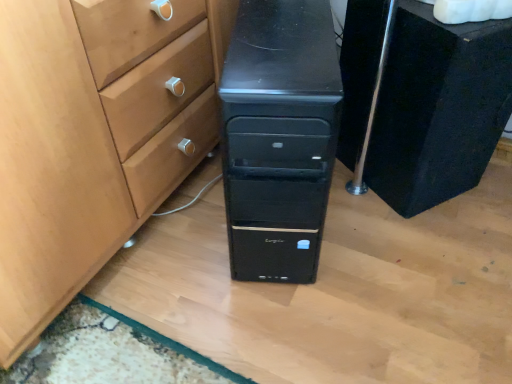
Where is `vacant region in front of black matte chest of drawers at center, which ranks as the first chest of drawers in left-to-right order`? vacant region in front of black matte chest of drawers at center, which ranks as the first chest of drawers in left-to-right order is located at coordinates (291, 318).